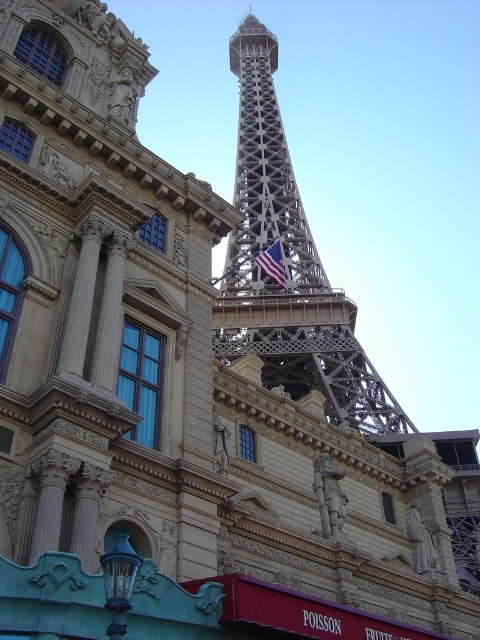
Does metallic structure at center come behind american flag at center?

No, metallic structure at center is closer to the viewer.

Between point (284, 356) and point (269, 266), which one is positioned in front?

Point (284, 356) is more forward.

Find the location of a particular element. The width and height of the screenshot is (480, 640). metallic structure at center is located at coordinates (288, 266).